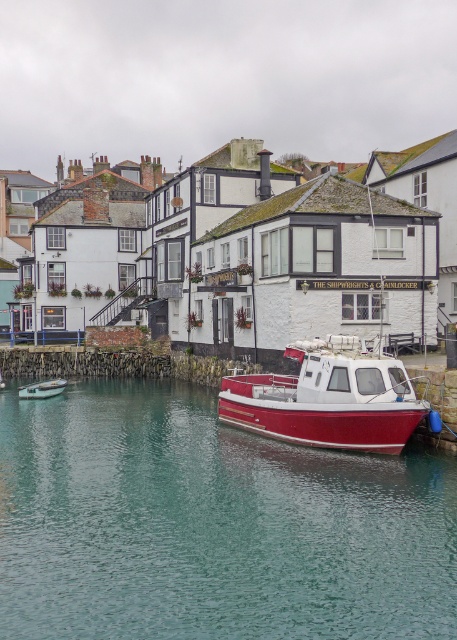
You are standing on the pier and want to know which object takes up more space in the image between the teal glossy water at lower center and the metallic silver boat at lower left. Can you tell me which one is bigger?

The teal glossy water at lower center has a larger size compared to the metallic silver boat at lower left, so the teal glossy water at lower center takes up more space in the image.